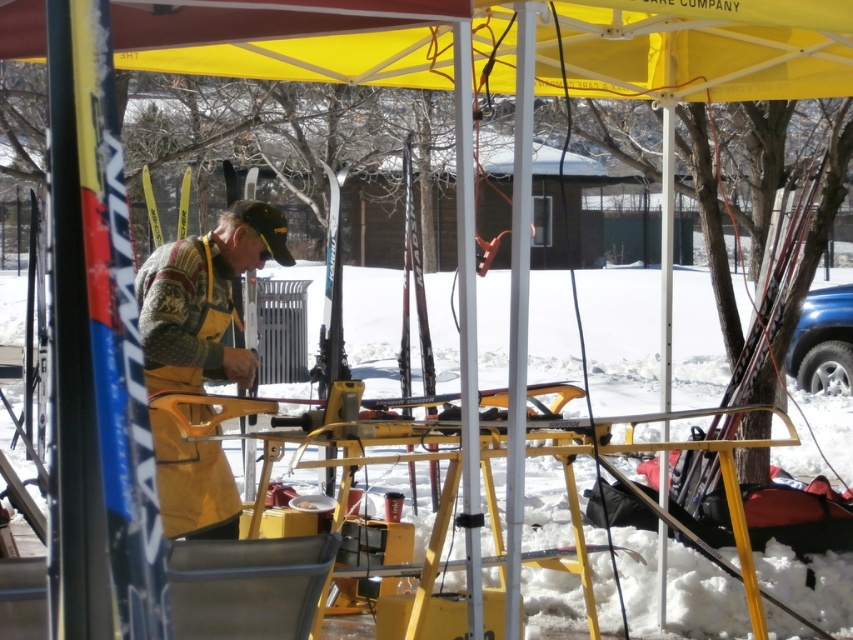
You are an observer standing in front of the ski tuning machine. Which object is shorter between the yellow fabric canopy at upper center and the knitted sweater at center?

The yellow fabric canopy at upper center has a lesser height compared to the knitted sweater at center, so the yellow fabric canopy at upper center is shorter.

You are a photographer trying to capture the yellow fabric canopy at upper center and the knitted sweater at center in a single shot. Since the camera has a limited field of view, you need to know which object is wider to adjust your framing. Which one is wider?

The yellow fabric canopy at upper center is wider than the knitted sweater at center because its width surpasses the sweater.

You are standing at the point with coordinates point (312, 38). Looking around, you see the yellow fabric canopy at upper center. Which direction should you walk to find the yellow ski tuning machine?

The yellow ski tuning machine is located below the yellow fabric canopy at upper center, so you should walk downward from point (312, 38) to reach it.